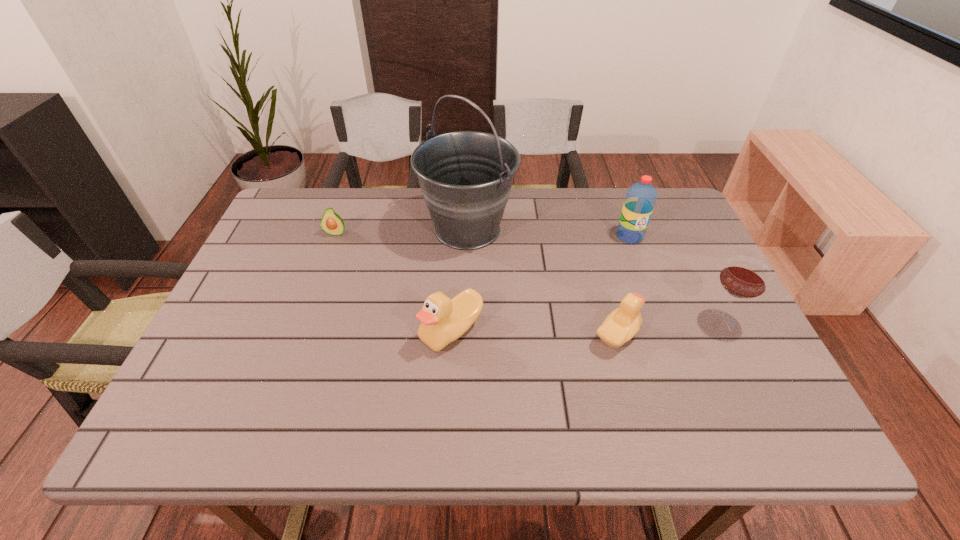
Image resolution: width=960 pixels, height=540 pixels. In order to click on avocado that is at the far edge in this screenshot , I will do `click(331, 223)`.

At what (x,y) coordinates should I click in order to perform the action: click on water bottle positioned at the right edge. Please return your answer as a coordinate pair (x, y). Looking at the image, I should click on (641, 197).

The width and height of the screenshot is (960, 540). Find the location of `wineglass that is at the right edge`. wineglass that is at the right edge is located at coordinates (743, 277).

Find the location of a particular element. object situated at the far right corner is located at coordinates (641, 197).

Image resolution: width=960 pixels, height=540 pixels. I want to click on free space at the far edge of the desktop, so click(588, 234).

Locate an element on the screen. The image size is (960, 540). free region at the near edge is located at coordinates coord(351,372).

Image resolution: width=960 pixels, height=540 pixels. Find the location of `blank space at the right edge`. blank space at the right edge is located at coordinates [x=703, y=252].

In the image, there is a desktop. Find the location of `free space at the far left corner`. free space at the far left corner is located at coordinates (316, 211).

You are a GUI agent. You are given a task and a screenshot of the screen. Output one action in this format:
    pyautogui.click(x=<x>, y=<y>)
    Task: Click on the free space between the tallest object and the fifth shortest object
    
    Given the screenshot: What is the action you would take?
    pyautogui.click(x=548, y=233)

This screenshot has width=960, height=540. I want to click on free space between the third tallest object and the fourth tallest object, so click(x=586, y=325).